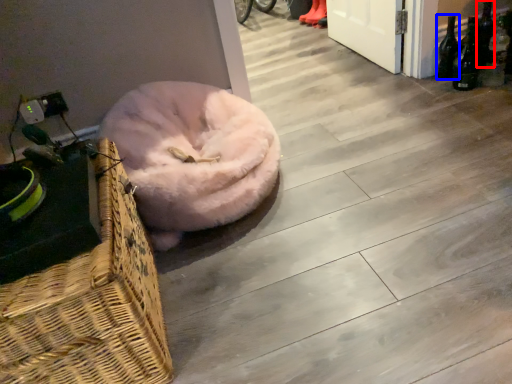
Question: Which object is closer to the camera taking this photo, bottle (highlighted by a red box) or bottle (highlighted by a blue box)?

Choices:
 (A) bottle
 (B) bottle

Answer: (B)